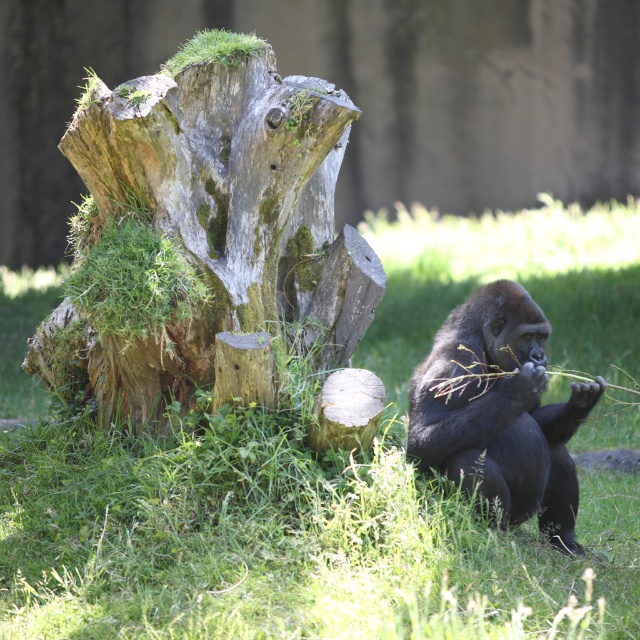
Is green grass at center thinner than weathered wood stump at center?

No, green grass at center is not thinner than weathered wood stump at center.

Between green grass at center and weathered wood stump at center, which one appears on the right side from the viewer's perspective?

From the viewer's perspective, weathered wood stump at center appears more on the right side.

Which is behind, point (296, 444) or point (214, 280)?

Positioned behind is point (214, 280).

At what (x,y) coordinates should I click in order to perform the action: click on green grass at center. Please return your answer as a coordinate pair (x, y). This screenshot has width=640, height=640. Looking at the image, I should click on (324, 474).

Does green grass at center have a lesser height compared to black fur ape at lower right?

No.

Is point (248, 540) in front of point (525, 333)?

Yes, point (248, 540) is closer to viewer.

Is point (593, 216) positioned before point (435, 349)?

That is False.

Find the location of a particular element. This screenshot has width=640, height=640. green grass at center is located at coordinates (324, 474).

Can you confirm if weathered wood stump at center is positioned to the right of black fur ape at lower right?

Incorrect, weathered wood stump at center is not on the right side of black fur ape at lower right.

Which is behind, point (92, 260) or point (509, 481)?

Point (509, 481)

Identify the location of weathered wood stump at center. This screenshot has height=640, width=640. (202, 227).